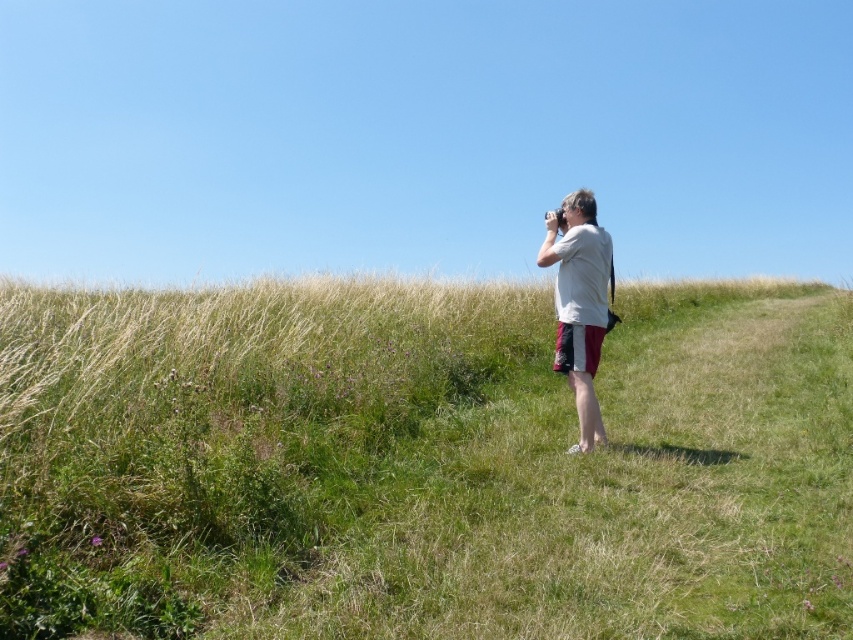
You are a photographer trying to capture the entire green grassy hillside at center and white cotton shirt at center in one frame. Given the camera settings, the maximum size you can capture is 1.2 meters. Can both objects fit in the frame?

The green grassy hillside at center has a larger size compared to the white cotton shirt at center. Since the maximum frame size is 1.2 meters, if the combined size of both objects exceeds this limit, they might not fit. However, without specific measurements of each object, it is uncertain. Please check the individual sizes.